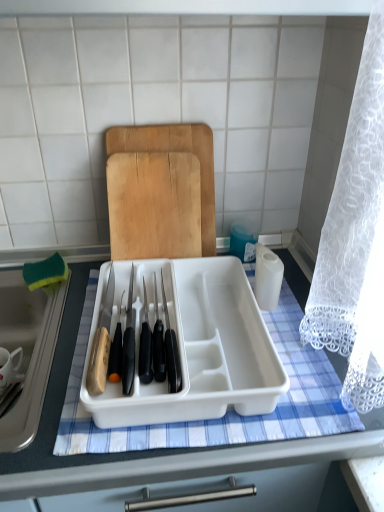
Identify the location of white plastic tray at center. (147, 451).

You are a GUI agent. You are given a task and a screenshot of the screen. Output one action in this format:
    pyautogui.click(x=<x>, y=<y>)
    Task: Click on the green sponge at left
    
    Given the screenshot: What is the action you would take?
    pyautogui.click(x=29, y=350)

From the image's perspective, between white plastic tray at center and white plastic tray at center, which one is located above?

From the image's view, white plastic tray at center is above.

Considering the sizes of white plastic tray at center and white plastic tray at center in the image, is white plastic tray at center taller or shorter than white plastic tray at center?

white plastic tray at center is shorter than white plastic tray at center.

Does white plastic tray at center have a lesser width compared to white plastic tray at center?

Indeed, white plastic tray at center has a lesser width compared to white plastic tray at center.

Consider the image. Is white plastic tray at center surrounded by white plastic tray at center?

No, white plastic tray at center is not surrounded by white plastic tray at center.

Which is behind, green sponge at left or wooden cutting board at center?

wooden cutting board at center.

Identify the location of cutting board above the green sponge at left (from the image's perspective). (161, 191).

Is point (38, 381) positioned behind point (157, 166)?

No, it is in front of (157, 166).

Based on the photo, from the image's perspective, which is below, green sponge at left or wooden cutting board at center?

green sponge at left appears lower in the image.

Find the location of a particular element. The image size is (384, 512). sink above the white plastic tray at center (from the image's perspective) is located at coordinates (29, 350).

Can you confirm if white plastic tray at center is taller than green sponge at left?

Yes.

Visually, is white plastic tray at center positioned to the left or to the right of green sponge at left?

Based on their positions, white plastic tray at center is located to the right of green sponge at left.

Is white plastic tray at center surrounding green sponge at left?

Yes, green sponge at left is inside white plastic tray at center.

How many degrees apart are the facing directions of white plastic tray at center and green sponge at left?

0.538 degrees.

Is white plastic tray at center wider or thinner than green sponge at left?

Clearly, white plastic tray at center has less width compared to green sponge at left.

From a real-world perspective, who is located higher, white plastic tray at center or green sponge at left?

In real-world perspective, white plastic tray at center is above.

From the image's perspective, which one is positioned lower, white plastic tray at center or green sponge at left?

From the image's view, green sponge at left is below.

How much distance is there between wooden cutting board at center and white plastic tray at center?

wooden cutting board at center and white plastic tray at center are 11.82 inches apart.

Choose the correct answer: Is wooden cutting board at center inside white plastic tray at center or outside it?

wooden cutting board at center is located beyond the bounds of white plastic tray at center.

From a real-world perspective, which object rests below the other?

In real-world perspective, white plastic tray at center is lower.

Considering the positions of points (186, 136) and (13, 488), is point (186, 136) farther from camera compared to point (13, 488)?

Yes, it is behind point (13, 488).

From their relative heights in the image, would you say white plastic tray at center is taller or shorter than wooden cutting board at center?

Clearly, white plastic tray at center is shorter compared to wooden cutting board at center.

In the image, is white plastic tray at center on the left side or the right side of wooden cutting board at center?

From the image, it's evident that white plastic tray at center is to the right of wooden cutting board at center.

Can you tell me how much white plastic tray at center and wooden cutting board at center differ in facing direction?

They differ by 1.59 degrees in their facing directions.

Is white plastic tray at center turned away from wooden cutting board at center?

Yes, wooden cutting board at center is at the back of white plastic tray at center.

Is wooden cutting board at center in front of white plastic tray at center?

No.

Which is behind, point (176, 233) or point (276, 399)?

Positioned behind is point (176, 233).

Is wooden cutting board at center beside white plastic tray at center?

They are not placed beside each other.

Is wooden cutting board at center outside of white plastic tray at center?

Yes, wooden cutting board at center is not within white plastic tray at center.

Where is `kitchen appliance located behind the white plastic tray at center`? kitchen appliance located behind the white plastic tray at center is located at coordinates (196, 348).

This screenshot has width=384, height=512. I want to click on cutting board above the green sponge at left (from a real-world perspective), so click(x=161, y=191).

Which object lies nearer to the anchor point white plastic tray at center, green sponge at left or white plastic tray at center?

Among the two, white plastic tray at center is located nearer to white plastic tray at center.

From the image, which object appears to be farther from green sponge at left, white plastic tray at center or white plastic tray at center?

white plastic tray at center is positioned further to the anchor green sponge at left.

Consider the image. Which object lies nearer to the anchor point wooden cutting board at center, white plastic tray at center or white plastic tray at center?

The object closer to wooden cutting board at center is white plastic tray at center.

Based on their spatial positions, is white plastic tray at center or green sponge at left closer to wooden cutting board at center?

white plastic tray at center is closer to wooden cutting board at center.

When comparing their distances from white plastic tray at center, does green sponge at left or wooden cutting board at center seem further?

The object further to white plastic tray at center is green sponge at left.

Considering their positions, is green sponge at left positioned closer to white plastic tray at center than wooden cutting board at center?

Based on the image, green sponge at left appears to be nearer to white plastic tray at center.

From the image, which object appears to be farther from white plastic tray at center, wooden cutting board at center or green sponge at left?

wooden cutting board at center is positioned further to the anchor white plastic tray at center.

From the image, which object appears to be farther from white plastic tray at center, wooden cutting board at center or green sponge at left?

The object further to white plastic tray at center is green sponge at left.

Where is `kitchen appliance that lies between wooden cutting board at center and white plastic tray at center from top to bottom`? kitchen appliance that lies between wooden cutting board at center and white plastic tray at center from top to bottom is located at coordinates (196, 348).

Find the location of a particular element. sink between wooden cutting board at center and white plastic tray at center vertically is located at coordinates (29, 350).

The height and width of the screenshot is (512, 384). In order to click on sink that lies between white plastic tray at center and white plastic tray at center from top to bottom in this screenshot , I will do `click(29, 350)`.

Find the location of a particular element. cutting board situated between green sponge at left and white plastic tray at center from left to right is located at coordinates (161, 191).